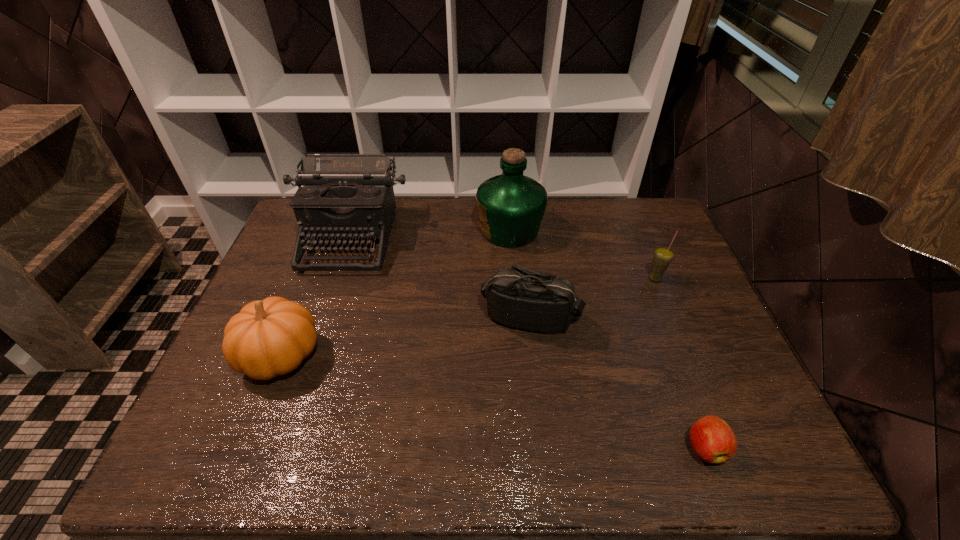
The height and width of the screenshot is (540, 960). Identify the location of free space located on the typing side of the typewriter. (304, 377).

I want to click on vacant region located 0.250m at the front padded panel of the shoulder bag, so click(x=543, y=430).

Locate an element on the screen. free space located on the right of the pumpkin is located at coordinates (372, 355).

This screenshot has height=540, width=960. In order to click on free space located 0.100m on the back of the straw for drinking in this screenshot , I will do `click(644, 251)`.

At what (x,y) coordinates should I click in order to perform the action: click on vacant space located on the back of the nearest object. Please return your answer as a coordinate pair (x, y). Looking at the image, I should click on (687, 400).

Find the location of `liquor at the far edge`. liquor at the far edge is located at coordinates (511, 206).

Identify the location of typewriter at the far edge. The image size is (960, 540). click(344, 196).

At what (x,y) coordinates should I click in order to perform the action: click on object that is at the near edge. Please return your answer as a coordinate pair (x, y). This screenshot has height=540, width=960. Looking at the image, I should click on (713, 440).

You are a GUI agent. You are given a task and a screenshot of the screen. Output one action in this format:
    pyautogui.click(x=<x>, y=<y>)
    Task: Click on the typewriter that is positioned at the left edge
    The image size is (960, 540).
    Given the screenshot: What is the action you would take?
    (344, 196)

Locate an element on the screen. The width and height of the screenshot is (960, 540). pumpkin that is at the left edge is located at coordinates tap(270, 337).